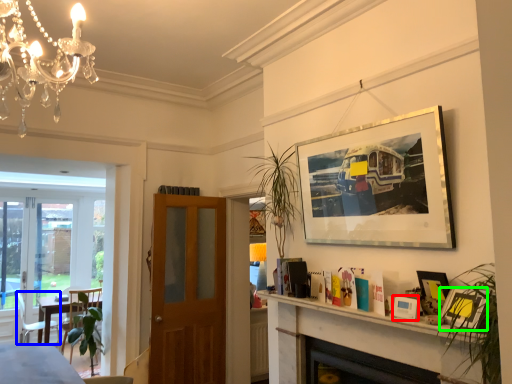
Question: Which object is the farthest from picture frame (highlighted by a red box)? Choose among these: chair (highlighted by a blue box) or picture frame (highlighted by a green box).

Choices:
 (A) chair
 (B) picture frame

Answer: (A)